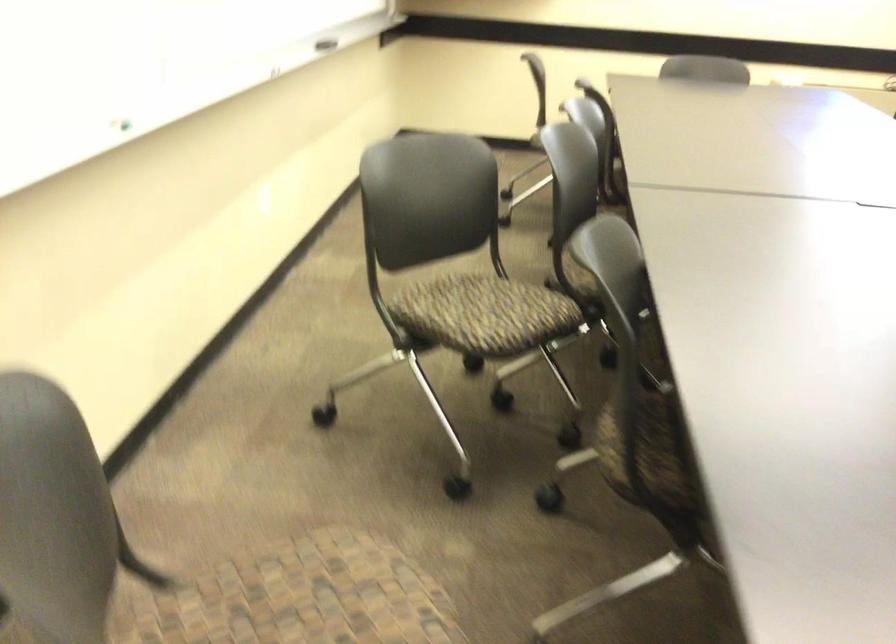
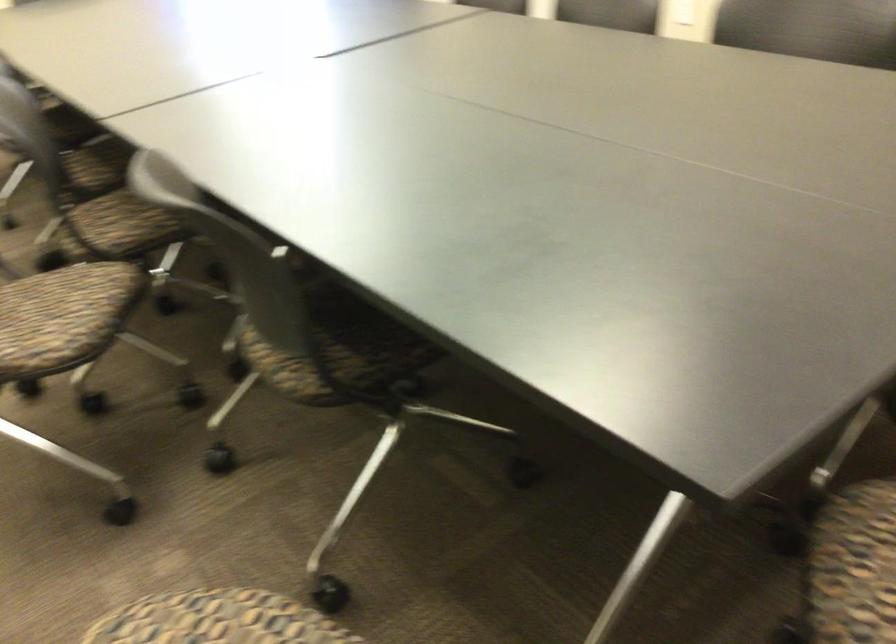
Question: The images are taken continuously from a first-person perspective. In which direction is your viewpoint rotating?

Choices:
 (A) Left
 (B) Right
 (C) Up
 (D) Down

Answer: (B)